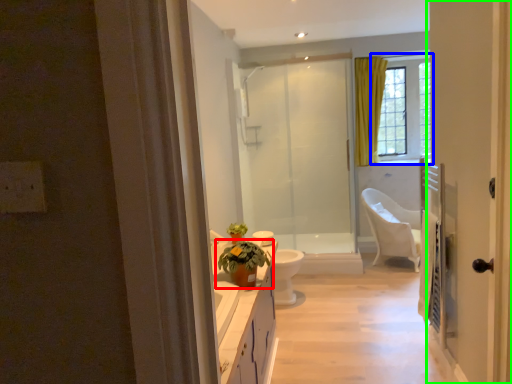
Question: Which object is the farthest from houseplant (highlighted by a red box)? Choose among these: window (highlighted by a blue box) or door (highlighted by a green box).

Choices:
 (A) window
 (B) door

Answer: (A)